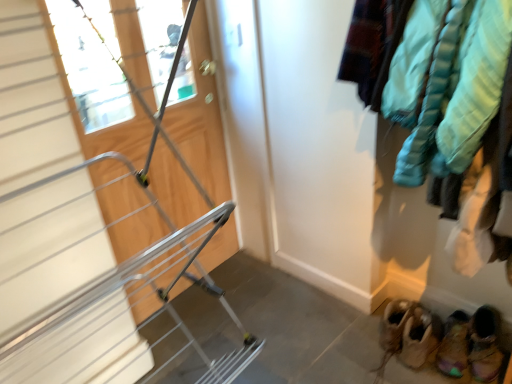
The width and height of the screenshot is (512, 384). What do you see at coordinates (419, 337) in the screenshot?
I see `brown suede moccasins at lower right, the 1th footwear in the left-to-right sequence` at bounding box center [419, 337].

This screenshot has width=512, height=384. What do you see at coordinates (201, 138) in the screenshot?
I see `wooden door at center` at bounding box center [201, 138].

The height and width of the screenshot is (384, 512). What do you see at coordinates (485, 345) in the screenshot?
I see `multicolored suede booties at lower right, placed as the 3th footwear when sorted from left to right` at bounding box center [485, 345].

Identify the location of brown suede moccasins at lower right, the third footwear in the right-to-left sequence. Image resolution: width=512 pixels, height=384 pixels. (419, 337).

Is multicolored suede booties at lower right, marked as the 1th footwear in a right-to-left arrangement, closer to the viewer compared to teal puffer jacket at right?

No, the depth of multicolored suede booties at lower right, marked as the 1th footwear in a right-to-left arrangement, is greater than that of teal puffer jacket at right.

Does multicolored suede booties at lower right, marked as the 1th footwear in a right-to-left arrangement, appear on the right side of teal puffer jacket at right?

Yes, multicolored suede booties at lower right, marked as the 1th footwear in a right-to-left arrangement, is to the right of teal puffer jacket at right.

Which of these two, multicolored suede booties at lower right, marked as the 1th footwear in a right-to-left arrangement, or teal puffer jacket at right, stands shorter?

Standing shorter between the two is multicolored suede booties at lower right, marked as the 1th footwear in a right-to-left arrangement.

Is there a large distance between multicolored suede booties at lower right, placed as the 3th footwear when sorted from left to right, and teal puffer jacket at right?

No, multicolored suede booties at lower right, placed as the 3th footwear when sorted from left to right, is not far away from teal puffer jacket at right.

From the image's perspective, between teal puffer jacket at right and wooden door at center, which one is located above?

From the image's view, teal puffer jacket at right is above.

Choose the correct answer: Is teal puffer jacket at right inside wooden door at center or outside it?

teal puffer jacket at right is spatially situated outside wooden door at center.

Locate an element on the screen. Image resolution: width=512 pixels, height=384 pixels. clothing positioned vertically above the wooden door at center (from a real-world perspective) is located at coordinates (439, 89).

Is point (494, 125) behind point (193, 48)?

No, (494, 125) is in front of (193, 48).

From the picture: Is leather suede booties at lower right, the 2th footwear in the right-to-left sequence, aimed at teal puffer jacket at right?

No.

Considering the relative positions of leather suede booties at lower right, the 2th footwear in the right-to-left sequence, and teal puffer jacket at right in the image provided, is leather suede booties at lower right, the 2th footwear in the right-to-left sequence, to the left of teal puffer jacket at right from the viewer's perspective?

No, leather suede booties at lower right, the 2th footwear in the right-to-left sequence, is not to the left of teal puffer jacket at right.

The image size is (512, 384). Identify the location of clothing that is on the left side of leather suede booties at lower right, the 2th footwear in the right-to-left sequence. tap(439, 89).

Does leather suede booties at lower right, the second footwear from the left, have a smaller size compared to teal puffer jacket at right?

Yes, leather suede booties at lower right, the second footwear from the left, is smaller than teal puffer jacket at right.

Considering the positions of objects multicolored suede booties at lower right, placed as the 3th footwear when sorted from left to right, and brown suede moccasins at lower right, the 1th footwear in the left-to-right sequence, in the image provided, who is more to the right, multicolored suede booties at lower right, placed as the 3th footwear when sorted from left to right, or brown suede moccasins at lower right, the 1th footwear in the left-to-right sequence,?

Positioned to the right is multicolored suede booties at lower right, placed as the 3th footwear when sorted from left to right.

Which of these two, multicolored suede booties at lower right, placed as the 3th footwear when sorted from left to right, or brown suede moccasins at lower right, the third footwear in the right-to-left sequence, is wider?

Wider between the two is brown suede moccasins at lower right, the third footwear in the right-to-left sequence.

Can you confirm if multicolored suede booties at lower right, marked as the 1th footwear in a right-to-left arrangement, is smaller than brown suede moccasins at lower right, the third footwear in the right-to-left sequence?

Actually, multicolored suede booties at lower right, marked as the 1th footwear in a right-to-left arrangement, might be larger than brown suede moccasins at lower right, the third footwear in the right-to-left sequence.

I want to click on the 2nd footwear counting from the right side of the brown suede moccasins at lower right, the 1th footwear in the left-to-right sequence, so click(485, 345).

Do you think brown suede moccasins at lower right, the 1th footwear in the left-to-right sequence, is within multicolored suede booties at lower right, placed as the 3th footwear when sorted from left to right, or outside of it?

brown suede moccasins at lower right, the 1th footwear in the left-to-right sequence, lies outside multicolored suede booties at lower right, placed as the 3th footwear when sorted from left to right.

Which of these two, brown suede moccasins at lower right, the third footwear in the right-to-left sequence, or multicolored suede booties at lower right, placed as the 3th footwear when sorted from left to right, stands taller?

multicolored suede booties at lower right, placed as the 3th footwear when sorted from left to right.

Is brown suede moccasins at lower right, the 1th footwear in the left-to-right sequence, positioned with its back to multicolored suede booties at lower right, placed as the 3th footwear when sorted from left to right?

No, brown suede moccasins at lower right, the 1th footwear in the left-to-right sequence,'s orientation is not away from multicolored suede booties at lower right, placed as the 3th footwear when sorted from left to right.

Relative to leather suede booties at lower right, the second footwear from the left, is teal puffer jacket at right in front or behind?

In the image, teal puffer jacket at right appears in front of leather suede booties at lower right, the second footwear from the left.

Find the location of `clothing lying in front of the leather suede booties at lower right, the second footwear from the left`. clothing lying in front of the leather suede booties at lower right, the second footwear from the left is located at coordinates (439, 89).

How much distance is there between teal puffer jacket at right and leather suede booties at lower right, the second footwear from the left?

teal puffer jacket at right is 82.17 centimeters from leather suede booties at lower right, the second footwear from the left.

Is teal puffer jacket at right located outside leather suede booties at lower right, the second footwear from the left?

That's correct, teal puffer jacket at right is outside of leather suede booties at lower right, the second footwear from the left.

Would you say leather suede booties at lower right, the 2th footwear in the right-to-left sequence, is part of brown suede moccasins at lower right, the third footwear in the right-to-left sequence,'s contents?

No, leather suede booties at lower right, the 2th footwear in the right-to-left sequence, is not inside brown suede moccasins at lower right, the third footwear in the right-to-left sequence.

From a real-world perspective, which is physically below, brown suede moccasins at lower right, the 1th footwear in the left-to-right sequence, or leather suede booties at lower right, the 2th footwear in the right-to-left sequence?

leather suede booties at lower right, the 2th footwear in the right-to-left sequence, is physically lower.

Is brown suede moccasins at lower right, the third footwear in the right-to-left sequence, looking in the opposite direction of leather suede booties at lower right, the 2th footwear in the right-to-left sequence?

No, brown suede moccasins at lower right, the third footwear in the right-to-left sequence,'s orientation is not away from leather suede booties at lower right, the 2th footwear in the right-to-left sequence.

Based on the photo, is brown suede moccasins at lower right, the third footwear in the right-to-left sequence, beside leather suede booties at lower right, the 2th footwear in the right-to-left sequence?

Yes, brown suede moccasins at lower right, the third footwear in the right-to-left sequence, is beside leather suede booties at lower right, the 2th footwear in the right-to-left sequence.

Locate an element on the screen. This screenshot has width=512, height=384. footwear that is the 2nd one when counting downward from the teal puffer jacket at right (from the image's perspective) is located at coordinates click(x=485, y=345).

The image size is (512, 384). Identify the location of clothing behind the wooden door at center. coord(439,89).

From the image, which object appears to be nearer to multicolored suede booties at lower right, placed as the 3th footwear when sorted from left to right, brown suede moccasins at lower right, the third footwear in the right-to-left sequence, or leather suede booties at lower right, the 2th footwear in the right-to-left sequence?

Based on the image, leather suede booties at lower right, the 2th footwear in the right-to-left sequence, appears to be nearer to multicolored suede booties at lower right, placed as the 3th footwear when sorted from left to right.

From the image, which object appears to be farther from teal puffer jacket at right, brown suede moccasins at lower right, the third footwear in the right-to-left sequence, or leather suede booties at lower right, the second footwear from the left?

leather suede booties at lower right, the second footwear from the left, is further to teal puffer jacket at right.

When comparing their distances from wooden door at center, does multicolored suede booties at lower right, marked as the 1th footwear in a right-to-left arrangement, or leather suede booties at lower right, the second footwear from the left, seem closer?

leather suede booties at lower right, the second footwear from the left, lies closer to wooden door at center than the other object.

Estimate the real-world distances between objects in this image. Which object is further from teal puffer jacket at right, leather suede booties at lower right, the 2th footwear in the right-to-left sequence, or brown suede moccasins at lower right, the third footwear in the right-to-left sequence?

The object further to teal puffer jacket at right is leather suede booties at lower right, the 2th footwear in the right-to-left sequence.

Estimate the real-world distances between objects in this image. Which object is closer to teal puffer jacket at right, leather suede booties at lower right, the 2th footwear in the right-to-left sequence, or multicolored suede booties at lower right, placed as the 3th footwear when sorted from left to right?

leather suede booties at lower right, the 2th footwear in the right-to-left sequence.

Looking at the image, which one is located closer to leather suede booties at lower right, the 2th footwear in the right-to-left sequence, multicolored suede booties at lower right, marked as the 1th footwear in a right-to-left arrangement, or wooden door at center?

multicolored suede booties at lower right, marked as the 1th footwear in a right-to-left arrangement, is closer to leather suede booties at lower right, the 2th footwear in the right-to-left sequence.

Based on their spatial positions, is teal puffer jacket at right or wooden door at center further from multicolored suede booties at lower right, placed as the 3th footwear when sorted from left to right?

Based on the image, wooden door at center appears to be further to multicolored suede booties at lower right, placed as the 3th footwear when sorted from left to right.

Looking at the image, which one is located further to brown suede moccasins at lower right, the 1th footwear in the left-to-right sequence, wooden door at center or leather suede booties at lower right, the second footwear from the left?

wooden door at center lies further to brown suede moccasins at lower right, the 1th footwear in the left-to-right sequence, than the other object.

Identify the location of footwear between brown suede moccasins at lower right, the 1th footwear in the left-to-right sequence, and multicolored suede booties at lower right, marked as the 1th footwear in a right-to-left arrangement, from left to right. (454, 345).

Image resolution: width=512 pixels, height=384 pixels. In order to click on clothing positioned between wooden door at center and brown suede moccasins at lower right, the 1th footwear in the left-to-right sequence, from near to far in this screenshot , I will do `click(439, 89)`.

Locate an element on the screen. footwear between teal puffer jacket at right and multicolored suede booties at lower right, placed as the 3th footwear when sorted from left to right, vertically is located at coordinates (419, 337).

At what (x,y) coordinates should I click in order to perform the action: click on clothing between wooden door at center and leather suede booties at lower right, the second footwear from the left, in the horizontal direction. Please return your answer as a coordinate pair (x, y). The width and height of the screenshot is (512, 384). Looking at the image, I should click on (439, 89).